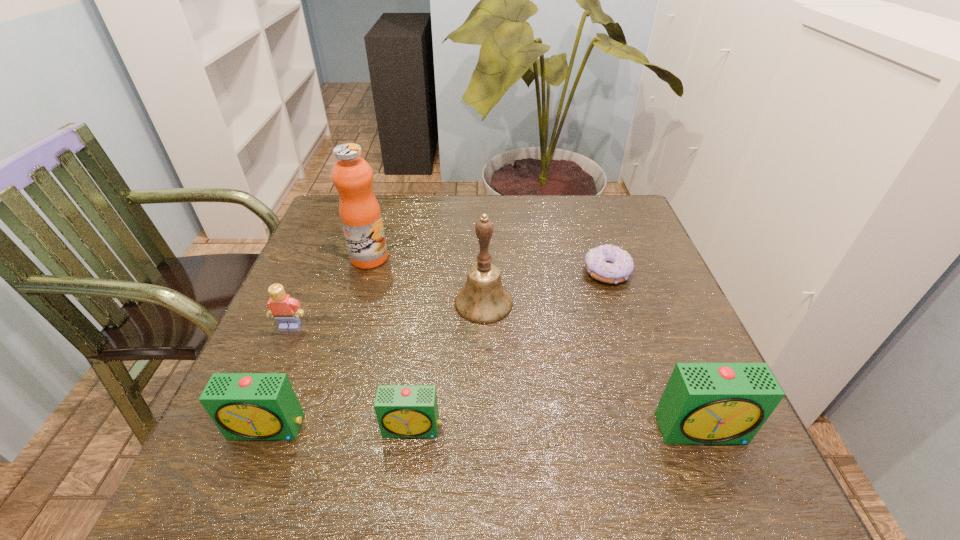
To make them evenly spaced by inserting another alarm_clock among them, please locate a vacant spot for this new alarm_clock. Please provide its 2D coordinates. Your answer should be formatted as a tuple, i.e. [(x, y)], where the tuple contains the x and y coordinates of a point satisfying the conditions above.

[(558, 429)]